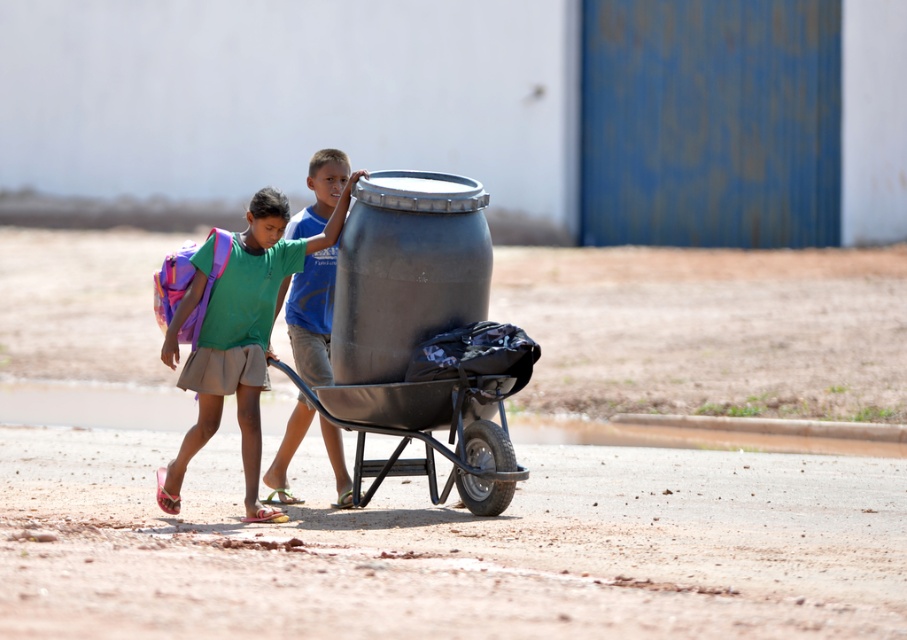
Consider the image. Does green fabric backpack at left appear on the right side of brushed metal barrel at center?

Incorrect, green fabric backpack at left is not on the right side of brushed metal barrel at center.

Is green fabric backpack at left bigger than brushed metal barrel at center?

Yes, green fabric backpack at left is bigger than brushed metal barrel at center.

The width and height of the screenshot is (907, 640). What do you see at coordinates (237, 333) in the screenshot?
I see `green fabric backpack at left` at bounding box center [237, 333].

Locate an element on the screen. The height and width of the screenshot is (640, 907). green fabric backpack at left is located at coordinates (237, 333).

Who is taller, green fabric backpack at left or black metal wheelbarrow at center?

green fabric backpack at left

Does green fabric backpack at left appear under black metal wheelbarrow at center?

No, green fabric backpack at left is not below black metal wheelbarrow at center.

The image size is (907, 640). I want to click on green fabric backpack at left, so click(237, 333).

Who is more distant from viewer, (382, 472) or (286, 288)?

The point (286, 288) is more distant.

Does point (403, 381) lie behind point (291, 304)?

No, it is not.

Image resolution: width=907 pixels, height=640 pixels. What are the coordinates of `black metal wheelbarrow at center` in the screenshot? It's located at (428, 436).